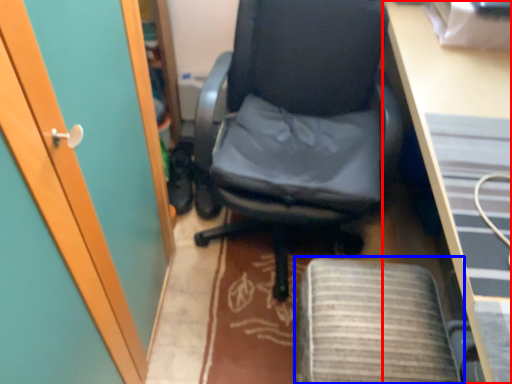
Question: Which object is further to the camera taking this photo, desk (highlighted by a red box) or computer chair (highlighted by a blue box)?

Choices:
 (A) desk
 (B) computer chair

Answer: (B)